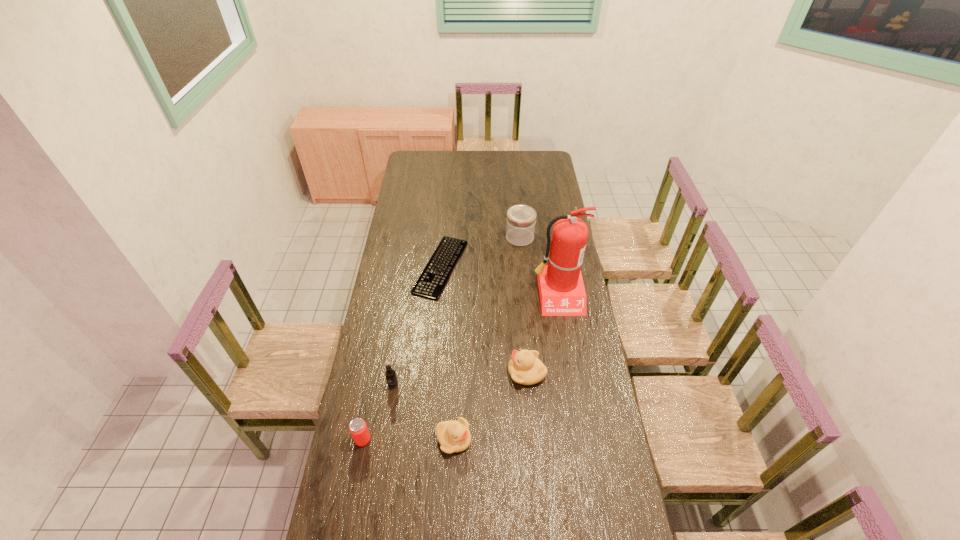
Identify the location of empty location between the tallest object and the nearer duckling. The image size is (960, 540). (506, 367).

Identify the location of free spot between the shortest object and the root beer. (417, 326).

Find the location of a particular element. free space between the shortest object and the tallest object is located at coordinates (499, 281).

What are the coordinates of `vacant space that is in between the jar and the computer keyboard` in the screenshot? It's located at (480, 252).

Identify the location of free space between the right duckling and the computer keyboard. The width and height of the screenshot is (960, 540). (484, 320).

The height and width of the screenshot is (540, 960). I want to click on vacant space that's between the farther duckling and the tallest object, so click(x=542, y=333).

At what (x,y) coordinates should I click in order to perform the action: click on the closest object to the computer keyboard. Please return your answer as a coordinate pair (x, y). Looking at the image, I should click on (521, 219).

Identify the location of the closest object to the tallest object. (521, 219).

Image resolution: width=960 pixels, height=540 pixels. In order to click on free spot that satisfies the following two spatial constraints: 1. on the front-facing side of the fire extinguisher; 2. on the beak of the right duckling in this screenshot , I will do `click(570, 373)`.

Find the location of a particular element. The height and width of the screenshot is (540, 960). free region that satisfies the following two spatial constraints: 1. on the back side of the computer keyboard; 2. on the left side of the leftmost object is located at coordinates (396, 267).